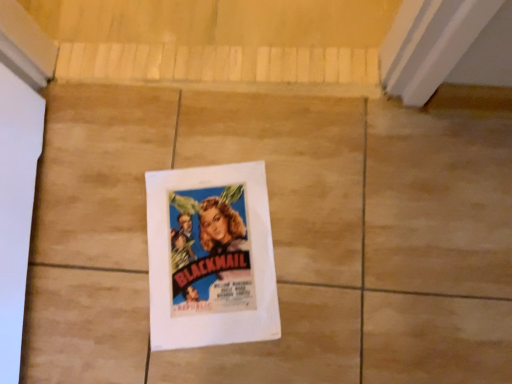
Where is `vacant point above matte paper poster at center (from a real-world perspective)`? The height and width of the screenshot is (384, 512). vacant point above matte paper poster at center (from a real-world perspective) is located at coordinates (211, 248).